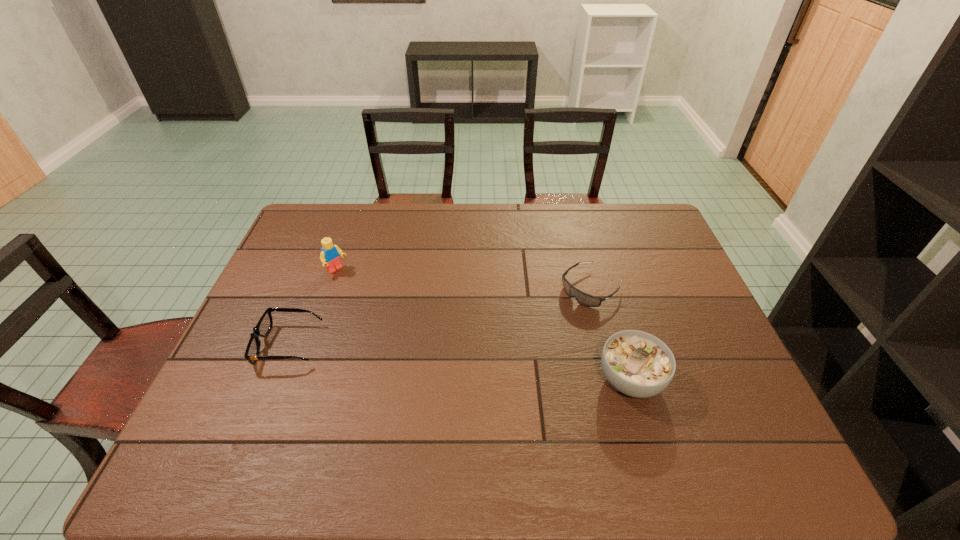
Locate an element on the screen. Image resolution: width=960 pixels, height=540 pixels. unoccupied area between the goggles and the sunglasses is located at coordinates pyautogui.click(x=440, y=316).

At what (x,y) coordinates should I click in order to perform the action: click on free space between the goggles and the tallest object. Please return your answer as a coordinate pair (x, y). The height and width of the screenshot is (540, 960). Looking at the image, I should click on (464, 279).

The width and height of the screenshot is (960, 540). I want to click on vacant area that lies between the third shortest object and the sunglasses, so click(x=460, y=362).

You are a GUI agent. You are given a task and a screenshot of the screen. Output one action in this format:
    pyautogui.click(x=<x>, y=<y>)
    Task: Click on the free space that is in between the goggles and the soup bowl
    Image resolution: width=960 pixels, height=540 pixels.
    Given the screenshot: What is the action you would take?
    pyautogui.click(x=611, y=334)

Locate an element on the screen. free space that is in between the sunglasses and the goggles is located at coordinates (440, 316).

Find the location of a particular element. vacant space that's between the Lego and the soup bowl is located at coordinates (484, 325).

Find the location of a particular element. Image resolution: width=960 pixels, height=540 pixels. free space between the tallest object and the goggles is located at coordinates (464, 279).

Identify the location of free space between the goggles and the sunglasses. The image size is (960, 540). (440, 316).

Locate an element on the screen. This screenshot has width=960, height=540. empty space that is in between the sunglasses and the tallest object is located at coordinates (313, 308).

You are a GUI agent. You are given a task and a screenshot of the screen. Output one action in this format:
    pyautogui.click(x=<x>, y=<y>)
    Task: Click on the vacant area that lies between the second tallest object and the goggles
    Image resolution: width=960 pixels, height=540 pixels.
    Given the screenshot: What is the action you would take?
    pyautogui.click(x=611, y=334)